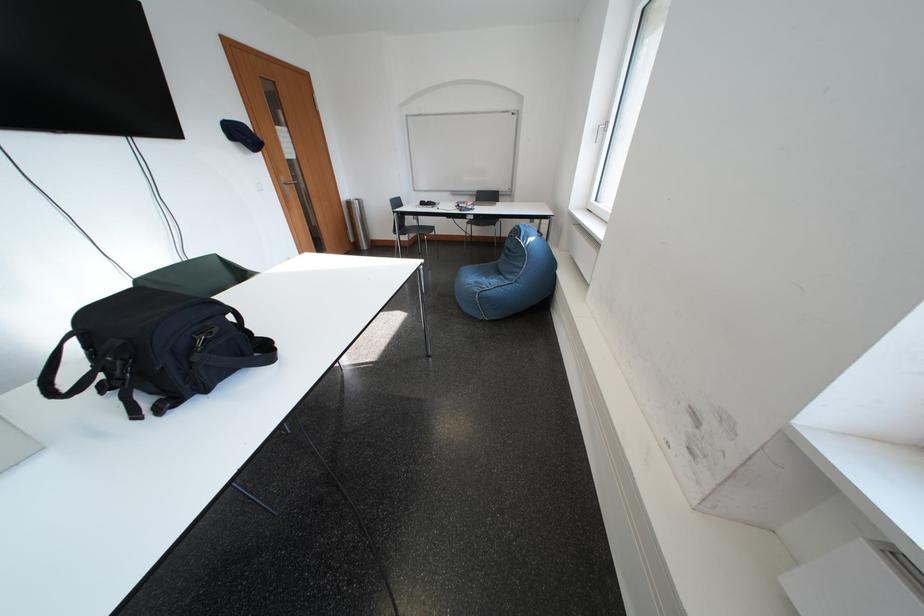
Where is `zipper pull`? The height and width of the screenshot is (616, 924). zipper pull is located at coordinates (600, 131).